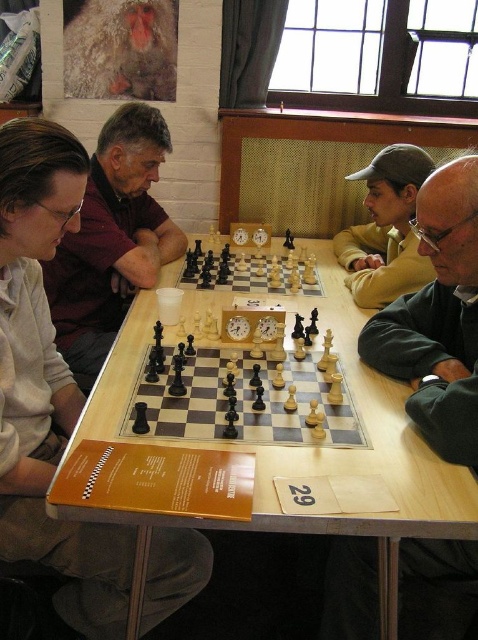
Can you confirm if light brown sweater at left is bigger than wooden chess set at center?

Yes, light brown sweater at left is bigger than wooden chess set at center.

Locate an element on the screen. This screenshot has height=640, width=478. light brown sweater at left is located at coordinates (46, 384).

Locate an element on the screen. The height and width of the screenshot is (640, 478). light brown sweater at left is located at coordinates (46, 384).

What do you see at coordinates (46, 384) in the screenshot? I see `light brown sweater at left` at bounding box center [46, 384].

Can you confirm if light brown sweater at left is thinner than matte black chess set at left?

Yes.

Is point (12, 289) in front of point (141, 180)?

Yes, it is.

Locate an element on the screen. light brown sweater at left is located at coordinates (46, 384).

Measure the distance between wooden chessboard at center and camera.

wooden chessboard at center and camera are 38.42 inches apart.

Does point (354, 472) lie in front of point (282, 291)?

Yes, it is in front of point (282, 291).

The image size is (478, 640). What do you see at coordinates (344, 451) in the screenshot? I see `wooden chessboard at center` at bounding box center [344, 451].

Identify the location of wooden chessboard at center. This screenshot has height=640, width=478. (344, 451).